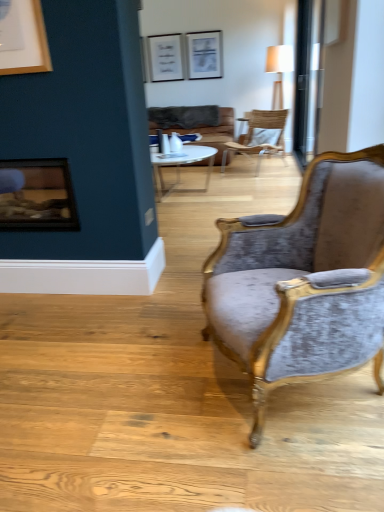
Identify the location of metallic silver picture frame at upper center. The height and width of the screenshot is (512, 384). (204, 55).

Find the location of a particular element. The height and width of the screenshot is (512, 384). wooden frame fireplace at left is located at coordinates (37, 195).

Measure the distance between white glass coffee table at center and camera.

white glass coffee table at center and camera are 4.26 meters apart from each other.

I want to click on wooden textured chair at center, the first chair positioned from the top, so click(x=260, y=136).

What do you see at coordinates (260, 136) in the screenshot?
I see `wooden textured chair at center, marked as the 2th chair in a bottom-to-top arrangement` at bounding box center [260, 136].

Image resolution: width=384 pixels, height=512 pixels. What are the coordinates of `transparent glass door at upper right` in the screenshot? It's located at [308, 79].

Describe the element at coordinates (198, 125) in the screenshot. I see `brown leather couch at center` at that location.

You are a GUI agent. You are given a task and a screenshot of the screen. Output one action in this format:
    pyautogui.click(x=<x>, y=<y>)
    Task: Click on the metallic silver picture frame at upper center
    
    Given the screenshot: What is the action you would take?
    coord(204,55)

From the picture: From a real-world perspective, who is located higher, transparent glass door at upper right or metallic silver picture frame at upper center?

metallic silver picture frame at upper center.

Considering the positions of objects transparent glass door at upper right and metallic silver picture frame at upper center in the image provided, who is more to the left, transparent glass door at upper right or metallic silver picture frame at upper center?

metallic silver picture frame at upper center is more to the left.

Consider the image. Is the position of transparent glass door at upper right more distant than that of metallic silver picture frame at upper center?

No, it is in front of metallic silver picture frame at upper center.

From the image's perspective, is transparent glass door at upper right located above or below metallic silver picture frame at upper center?

Based on their image positions, transparent glass door at upper right is located beneath metallic silver picture frame at upper center.

Considering the sizes of objects velvet grey chair at center, which appears as the first chair when viewed from the front, and metallic silver picture frame at upper center in the image provided, who is wider, velvet grey chair at center, which appears as the first chair when viewed from the front, or metallic silver picture frame at upper center?

velvet grey chair at center, which appears as the first chair when viewed from the front.

Considering the positions of point (288, 262) and point (212, 52), is point (288, 262) closer or farther from the camera than point (212, 52)?

Clearly, point (288, 262) is closer to the camera than point (212, 52).

Is velvet grey chair at center, which appears as the first chair when viewed from the front, taller than metallic silver picture frame at upper center?

Yes.

From a real-world perspective, is velvet grey chair at center, which appears as the first chair when viewed from the front, above or below metallic silver picture frame at upper center?

Clearly, from a real-world perspective, velvet grey chair at center, which appears as the first chair when viewed from the front, is below metallic silver picture frame at upper center.

From a real-world perspective, does wooden frame fireplace at left sit lower than velvet grey chair at center, which is the first chair from bottom to top?

Incorrect, from a real-world perspective, wooden frame fireplace at left is higher than velvet grey chair at center, which is the first chair from bottom to top.

Locate an element on the screen. the 1st chair to the right when counting from the wooden frame fireplace at left is located at coordinates (303, 280).

Does wooden frame fireplace at left appear on the left side of velvet grey chair at center, acting as the second chair starting from the top?

Correct, you'll find wooden frame fireplace at left to the left of velvet grey chair at center, acting as the second chair starting from the top.

Which of these two, wooden textured chair at center, marked as the 2th chair in a bottom-to-top arrangement, or white glass coffee table at center, is bigger?

white glass coffee table at center is bigger.

Is white glass coffee table at center completely or partially inside wooden textured chair at center, the first chair positioned from the top?

No.

Is wooden textured chair at center, which is the 1th chair from back to front, facing away from white glass coffee table at center?

No, wooden textured chair at center, which is the 1th chair from back to front, is not facing away from white glass coffee table at center.

Is metallic silver picture frame at upper center completely or partially outside of white glass coffee table at center?

Absolutely, metallic silver picture frame at upper center is external to white glass coffee table at center.

What's the angular difference between metallic silver picture frame at upper center and white glass coffee table at center's facing directions?

The facing directions of metallic silver picture frame at upper center and white glass coffee table at center are 90.3 degrees apart.

Where is `picture frame located on the right of white glass coffee table at center`? The height and width of the screenshot is (512, 384). picture frame located on the right of white glass coffee table at center is located at coordinates (204, 55).

From the image's perspective, is metallic silver picture frame at upper center positioned above or below white glass coffee table at center?

From the image's perspective, metallic silver picture frame at upper center appears above white glass coffee table at center.

The height and width of the screenshot is (512, 384). I want to click on chair located on the right of velvet grey chair at center, which appears as the first chair when viewed from the front, so click(x=260, y=136).

Between wooden textured chair at center, marked as the 2th chair in a bottom-to-top arrangement, and velvet grey chair at center, acting as the second chair starting from the top, which one has smaller width?

With smaller width is velvet grey chair at center, acting as the second chair starting from the top.

Would you consider brown leather couch at center to be distant from white glass coffee table at center?

brown leather couch at center is positioned a significant distance from white glass coffee table at center.

Which is behind, brown leather couch at center or white glass coffee table at center?

Positioned behind is brown leather couch at center.

I want to click on glass door on the right side of metallic silver picture frame at upper center, so click(x=308, y=79).

Image resolution: width=384 pixels, height=512 pixels. What are the coordinates of `the 2nd chair below the metallic silver picture frame at upper center (from the image's perspective)` in the screenshot? It's located at (303, 280).

Considering their positions, is wooden textured chair at center, which is the 1th chair from back to front, positioned further to white glass coffee table at center than brown leather couch at center?

brown leather couch at center lies further to white glass coffee table at center than the other object.

Estimate the real-world distances between objects in this image. Which object is closer to wooden frame fireplace at left, brown leather couch at center or transparent glass door at upper right?

Among the two, transparent glass door at upper right is located nearer to wooden frame fireplace at left.

From the image, which object appears to be nearer to wooden textured chair at center, the 2th chair positioned from the front, white glass coffee table at center or brown leather couch at center?

brown leather couch at center is positioned closer to the anchor wooden textured chair at center, the 2th chair positioned from the front.

Considering their positions, is wooden textured chair at center, the first chair positioned from the top, positioned closer to transparent glass door at upper right than brown leather couch at center?

Among the two, wooden textured chair at center, the first chair positioned from the top, is located nearer to transparent glass door at upper right.

Considering their positions, is velvet grey chair at center, which is the first chair from bottom to top, positioned further to white glass coffee table at center than metallic silver picture frame at upper center?

Among the two, velvet grey chair at center, which is the first chair from bottom to top, is located further to white glass coffee table at center.

From the image, which object appears to be farther from metallic silver picture frame at upper center, brown leather couch at center or wooden textured chair at center, which is the 1th chair from back to front?

Among the two, wooden textured chair at center, which is the 1th chair from back to front, is located further to metallic silver picture frame at upper center.

Based on their spatial positions, is velvet grey chair at center, which appears as the first chair when viewed from the front, or white glass coffee table at center further from wooden frame fireplace at left?

white glass coffee table at center.

From the image, which object appears to be nearer to brown leather couch at center, transparent glass door at upper right or velvet grey chair at center, which is the first chair from bottom to top?

transparent glass door at upper right is positioned closer to the anchor brown leather couch at center.

You are a GUI agent. You are given a task and a screenshot of the screen. Output one action in this format:
    pyautogui.click(x=<x>, y=<y>)
    Task: Click on the studio couch situated between white glass coffee table at center and transparent glass door at upper right from left to right
    
    Given the screenshot: What is the action you would take?
    pyautogui.click(x=198, y=125)

Find the location of a particular element. fireplace positioned between velvet grey chair at center, the 2th chair viewed from the back, and white glass coffee table at center from near to far is located at coordinates (37, 195).

The image size is (384, 512). In order to click on glass door positioned between white glass coffee table at center and metallic silver picture frame at upper center from near to far in this screenshot , I will do `click(308, 79)`.

Locate an element on the screen. The height and width of the screenshot is (512, 384). coffee table between wooden frame fireplace at left and transparent glass door at upper right in the horizontal direction is located at coordinates (181, 166).